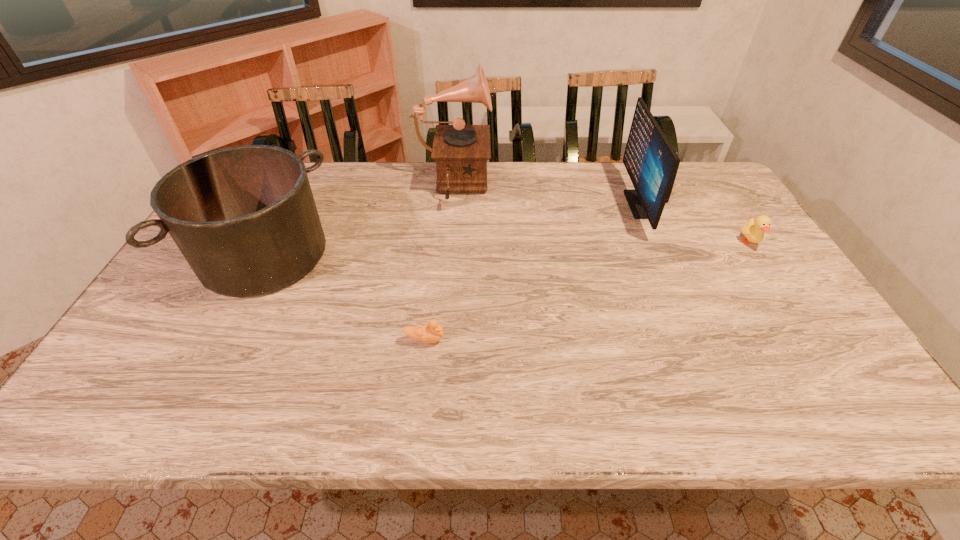
Locate an element on the screen. The height and width of the screenshot is (540, 960). record player is located at coordinates coord(461,151).

Where is `computer monitor`? The image size is (960, 540). computer monitor is located at coordinates click(651, 162).

The image size is (960, 540). Identify the location of the leftmost object. (244, 217).

At what (x,y) coordinates should I click in order to perform the action: click on the taller duckling. Please return your answer as a coordinate pair (x, y). Image resolution: width=960 pixels, height=540 pixels. Looking at the image, I should click on (754, 230).

Where is `the fourth tallest object`? The height and width of the screenshot is (540, 960). the fourth tallest object is located at coordinates (754, 230).

At what (x,y) coordinates should I click in order to perform the action: click on the nearest object. Please return your answer as a coordinate pair (x, y). The height and width of the screenshot is (540, 960). Looking at the image, I should click on (433, 332).

Locate an element on the screen. This screenshot has width=960, height=540. the left duckling is located at coordinates (433, 332).

This screenshot has height=540, width=960. I want to click on blank area located on the horn of the record player, so (584, 186).

Where is `vacant space located on the screen side of the fourth object from left to right`? vacant space located on the screen side of the fourth object from left to right is located at coordinates (522, 204).

This screenshot has height=540, width=960. I want to click on vacant space located on the screen side of the fourth object from left to right, so click(x=522, y=204).